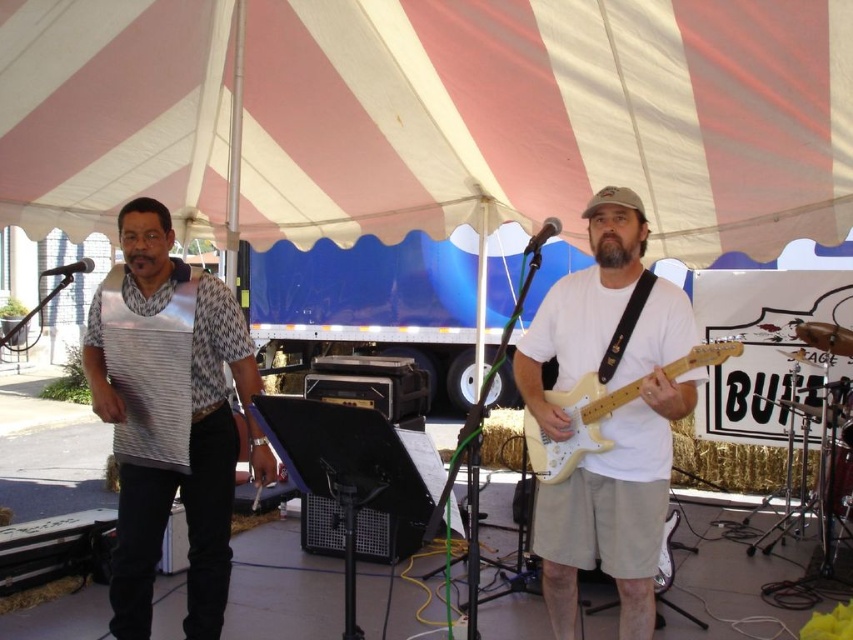
Does white matte guitar at center have a greater height compared to metallic silver harmonica at center?

Yes, white matte guitar at center is taller than metallic silver harmonica at center.

Who is taller, white matte guitar at center or metallic silver harmonica at center?

Standing taller between the two is white matte guitar at center.

Does point (583, 356) come farther from viewer compared to point (254, 440)?

That is False.

What are the coordinates of `white matte guitar at center` in the screenshot? It's located at (621, 477).

Is point (584, 211) closer to camera compared to point (194, 490)?

Yes, it is in front of point (194, 490).

This screenshot has width=853, height=640. Describe the element at coordinates (621, 477) in the screenshot. I see `white matte guitar at center` at that location.

Find the location of a particular element. This screenshot has height=640, width=853. white matte guitar at center is located at coordinates (621, 477).

Looking at this image, is metallic washboard at left below metallic silver harmonica at center?

No, metallic washboard at left is not below metallic silver harmonica at center.

Can you confirm if metallic washboard at left is positioned to the left of metallic silver harmonica at center?

Yes, metallic washboard at left is to the left of metallic silver harmonica at center.

At what (x,y) coordinates should I click in order to perform the action: click on metallic washboard at left. Please return your answer as a coordinate pair (x, y). This screenshot has width=853, height=640. Looking at the image, I should click on (178, 468).